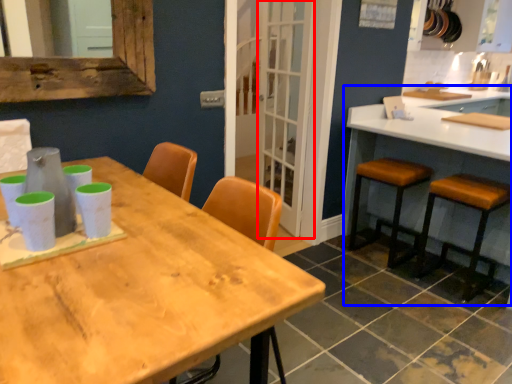
Question: Among these objects, which one is nearest to the camera, screen door (highlighted by a red box) or counter (highlighted by a blue box)?

Choices:
 (A) screen door
 (B) counter

Answer: (B)